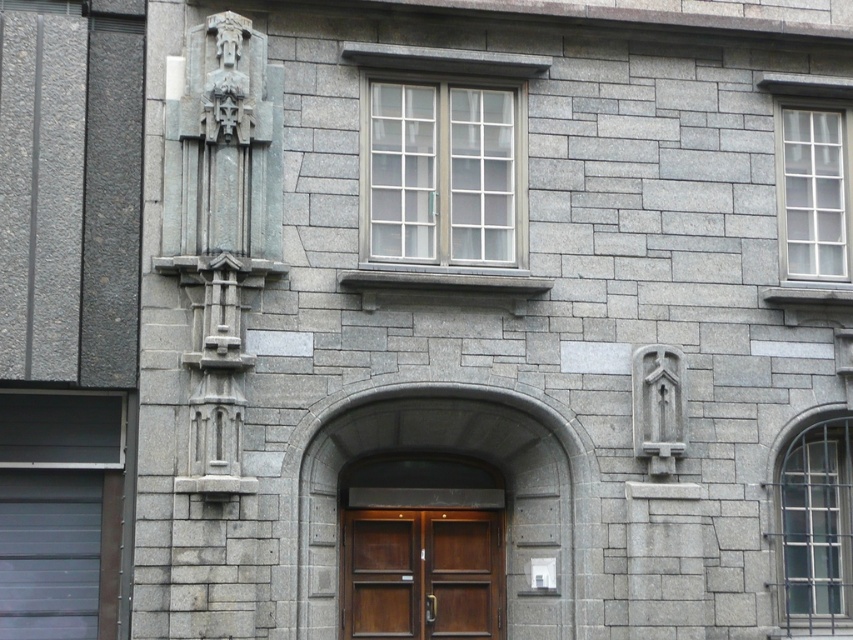
Who is positioned more to the left, clear glass window at center or wooden door at center?

wooden door at center

Is point (457, 112) in front of point (378, 540)?

Yes.

Where is `clear glass window at center`? clear glass window at center is located at coordinates (442, 172).

What do you see at coordinates (442, 172) in the screenshot?
I see `clear glass window at center` at bounding box center [442, 172].

This screenshot has height=640, width=853. I want to click on clear glass window at center, so click(442, 172).

Between point (386, 134) and point (784, 586), which one is positioned behind?

Point (386, 134)

Identify the location of clear glass window at center. (442, 172).

Which is more to the left, clear glass window at upper right or clear glass window at center right?

Positioned to the left is clear glass window at center right.

Does point (840, 189) come farther from viewer compared to point (817, 620)?

That is True.

Where is `clear glass window at upper right`? This screenshot has height=640, width=853. clear glass window at upper right is located at coordinates (811, 173).